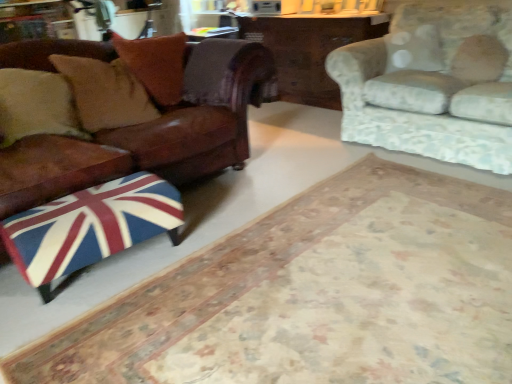
This screenshot has width=512, height=384. I want to click on free space between union jack fabric ottoman at lower left and union jack fabric ottoman at lower left, so click(216, 226).